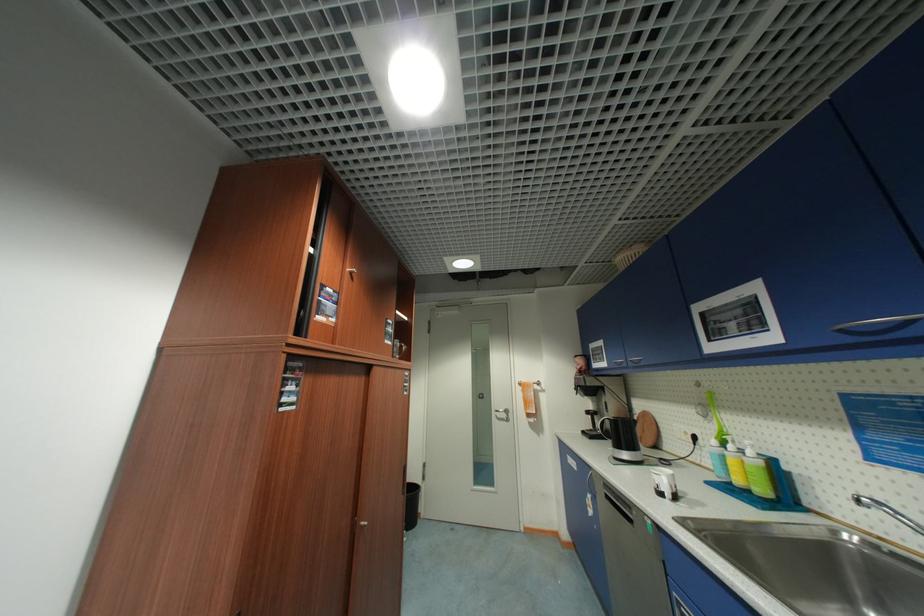
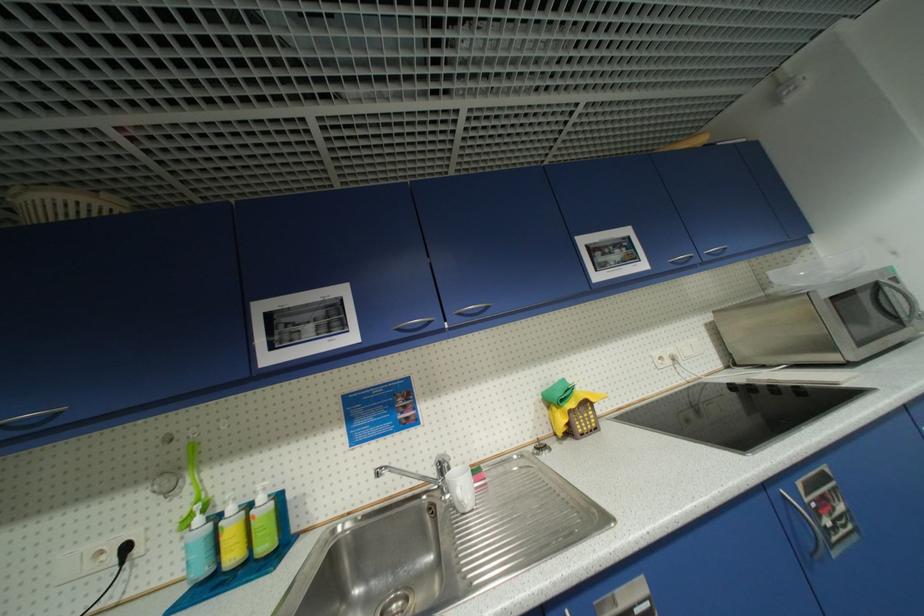
Where in the second image is the point corresponding to pixel 756 454 from the first image?

(266, 500)